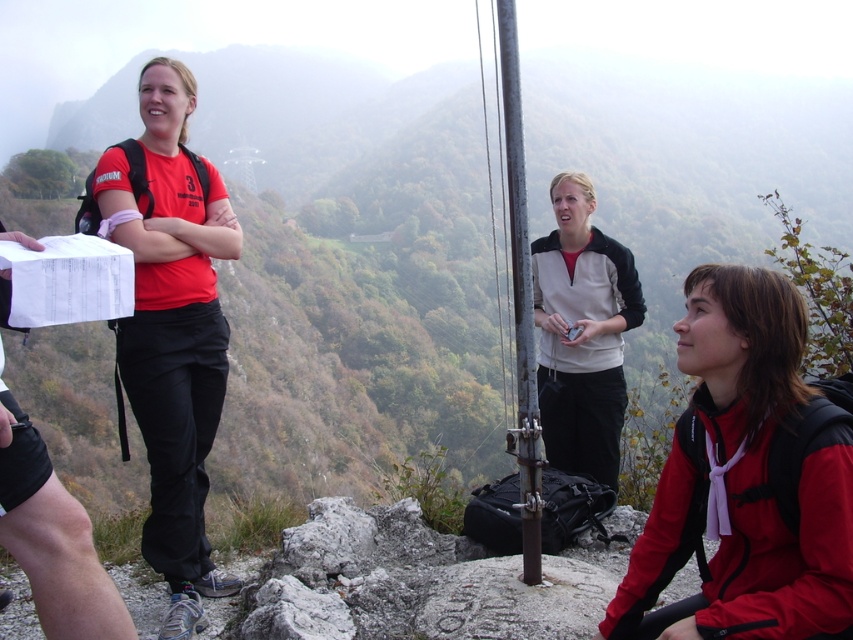
Question: Does matte red jacket at lower right appear on the left side of white fleece jacket at center?

Choices:
 (A) no
 (B) yes

Answer: (A)

Question: Can you confirm if matte red shirt at left is positioned to the right of metallic pole at center?

Choices:
 (A) no
 (B) yes

Answer: (A)

Question: Which point appears closest to the camera in this image?

Choices:
 (A) coord(152,490)
 (B) coord(520,180)
 (C) coord(688,483)
 (D) coord(547,340)

Answer: (C)

Question: Which of the following is the closest to the observer?

Choices:
 (A) matte red jacket at lower right
 (B) white fleece jacket at center
 (C) matte red shirt at left

Answer: (A)

Question: Which object is positioned farthest from the matte red jacket at lower right?

Choices:
 (A) white fleece jacket at center
 (B) matte red shirt at left

Answer: (B)

Question: Is matte red shirt at left thinner than white fleece jacket at center?

Choices:
 (A) no
 (B) yes

Answer: (B)